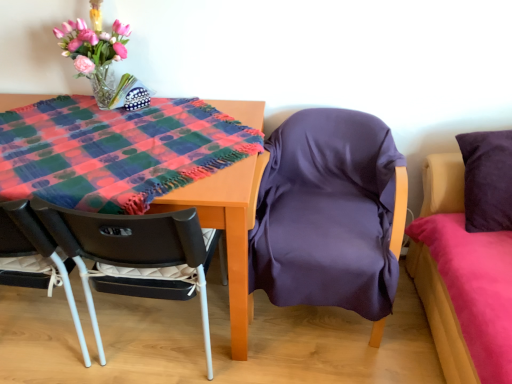
Question: In the image, is wooden table at center on the left side or the right side of purple satin chair at center, marked as the first chair in a right-to-left arrangement?

Choices:
 (A) right
 (B) left

Answer: (B)

Question: Considering the positions of point (241, 331) and point (342, 135), is point (241, 331) closer or farther from the camera than point (342, 135)?

Choices:
 (A) farther
 (B) closer

Answer: (B)

Question: Based on their relative distances, which object is nearer to the purple satin bed at right?

Choices:
 (A) wooden table at center
 (B) matte black chair at lower left, which appears as the 2th chair when viewed from the right
 (C) purple satin chair at center, marked as the first chair in a right-to-left arrangement

Answer: (C)

Question: Which of these objects is positioned farthest from the purple satin bed at right?

Choices:
 (A) matte black chair at lower left, which appears as the 2th chair when viewed from the right
 (B) purple satin chair at center, marked as the first chair in a right-to-left arrangement
 (C) wooden table at center

Answer: (A)